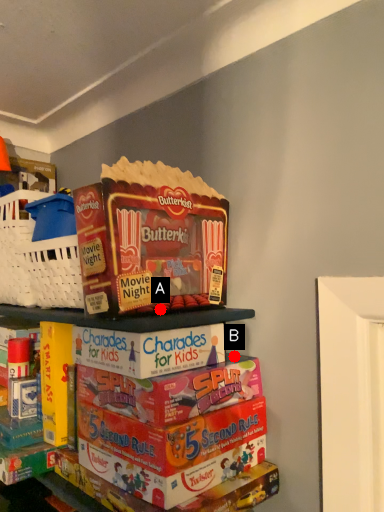
Question: Two points are circled on the image, labeled by A and B beside each circle. Which point is closer to the camera?

Choices:
 (A) A is closer
 (B) B is closer

Answer: (A)